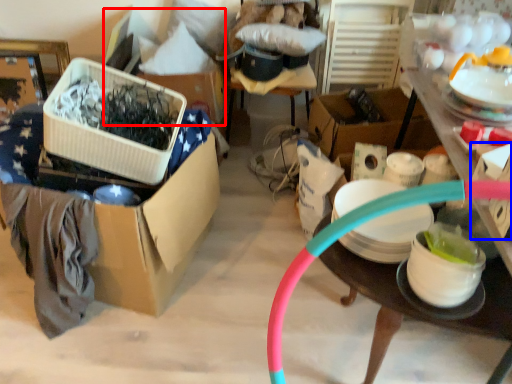
Question: Which point is further to the camera, storage box (highlighted by a red box) or storage box (highlighted by a blue box)?

Choices:
 (A) storage box
 (B) storage box

Answer: (A)